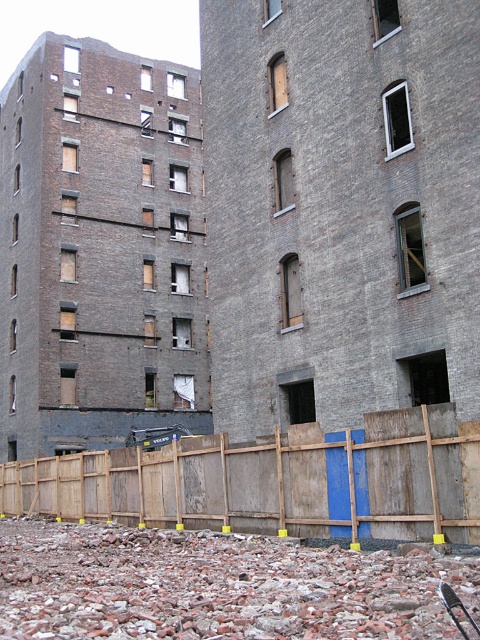
Question: Which point is closer to the camera?

Choices:
 (A) dark gray brick building at left
 (B) rusty gravel pile at lower center
 (C) wooden fence at lower center

Answer: (B)

Question: Can you confirm if dark gray brick building at left is positioned to the right of rusty gravel pile at lower center?

Choices:
 (A) no
 (B) yes

Answer: (A)

Question: Can you confirm if rusty gravel pile at lower center is smaller than wooden fence at lower center?

Choices:
 (A) yes
 (B) no

Answer: (A)

Question: Which object is closer to the camera taking this photo?

Choices:
 (A) rusty gravel pile at lower center
 (B) wooden fence at lower center
 (C) dark gray brick building at left

Answer: (A)

Question: Does rusty gravel pile at lower center have a smaller size compared to wooden fence at lower center?

Choices:
 (A) yes
 (B) no

Answer: (A)

Question: Which point is farther to the camera?

Choices:
 (A) wooden fence at lower center
 (B) dark gray brick building at left

Answer: (B)